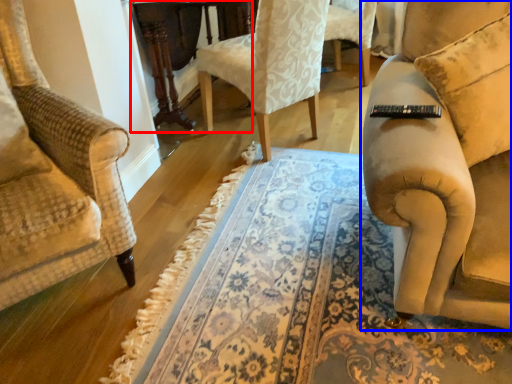
Question: Among these objects, which one is farthest to the camera, round table (highlighted by a red box) or studio couch (highlighted by a blue box)?

Choices:
 (A) round table
 (B) studio couch

Answer: (A)